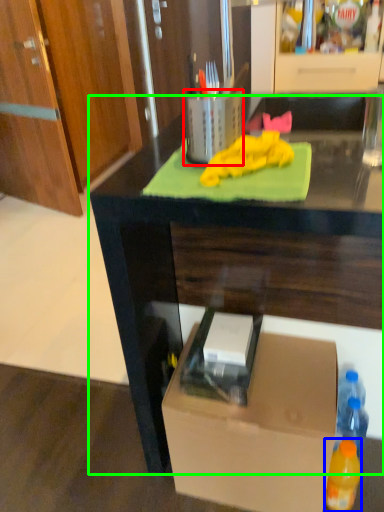
Question: Which is farther away from appliance (highlighted by a red box)? bottle (highlighted by a blue box) or desk (highlighted by a green box)?

Choices:
 (A) bottle
 (B) desk

Answer: (A)